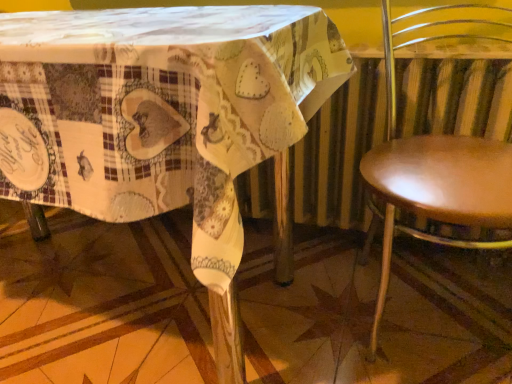
Identify the location of vacant area situated below shiny brown seat at right (from a real-world perspective). The width and height of the screenshot is (512, 384). (428, 321).